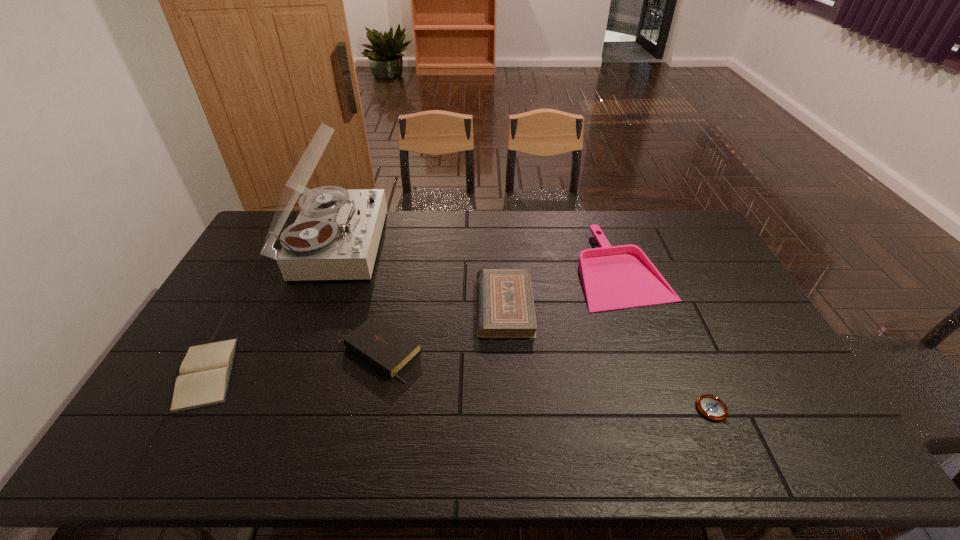
Locate an element on the screen. The image size is (960, 540). free space in the image that satisfies the following two spatial constraints: 1. on the front side of the compass; 2. on the left side of the record player is located at coordinates (270, 410).

The image size is (960, 540). In order to click on free location that satisfies the following two spatial constraints: 1. on the spine side of the fourth object from left to right; 2. on the front side of the second Bible from right to left in this screenshot , I will do `click(507, 352)`.

Where is `vacant space that satisfies the following two spatial constraints: 1. on the spine side of the compass; 2. on the left side of the fourth object from left to right`? The width and height of the screenshot is (960, 540). vacant space that satisfies the following two spatial constraints: 1. on the spine side of the compass; 2. on the left side of the fourth object from left to right is located at coordinates (511, 410).

What are the coordinates of `vacant position in the image that satisfies the following two spatial constraints: 1. on the handle side of the shortest object; 2. on the left side of the dustpan` in the screenshot? It's located at (674, 410).

Image resolution: width=960 pixels, height=540 pixels. I want to click on free space that satisfies the following two spatial constraints: 1. on the handle side of the compass; 2. on the left side of the dustpan, so click(x=674, y=410).